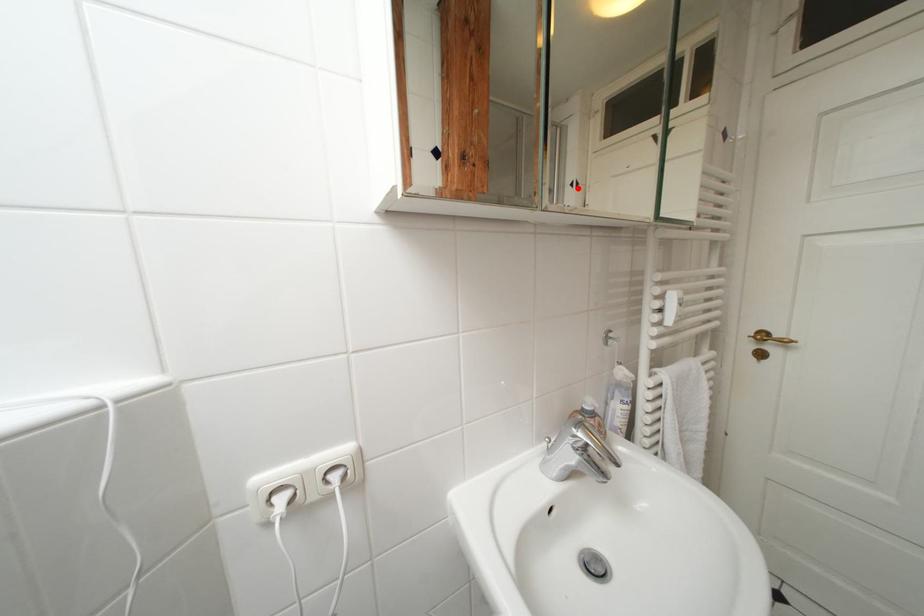
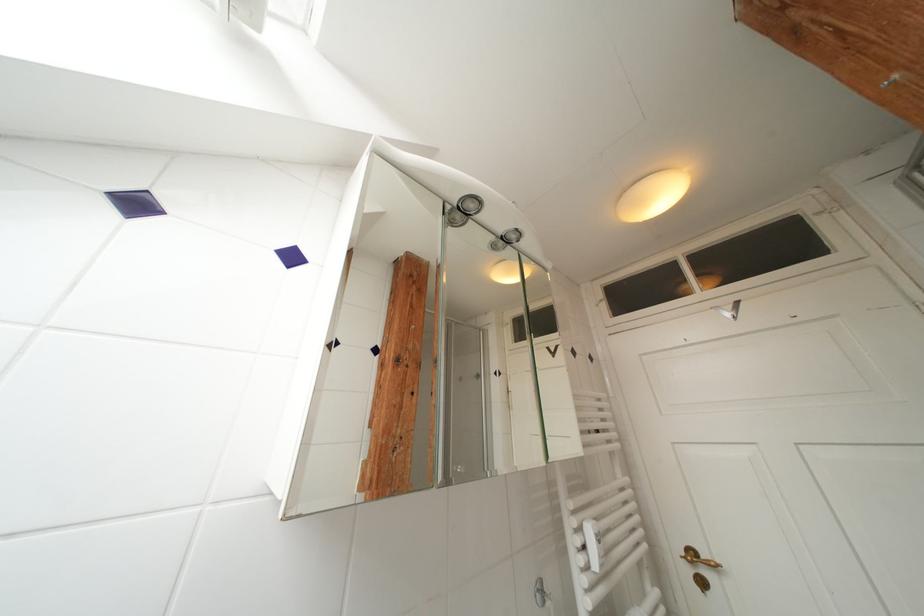
Locate, in the second image, the point that corresponds to the highlighted location in the first image.

(502, 377)